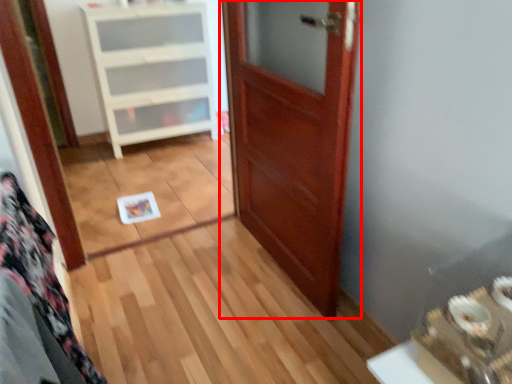
Question: Observing the image, what is the correct spatial positioning of door (annotated by the red box) in reference to cabinetry?

Choices:
 (A) right
 (B) left

Answer: (A)